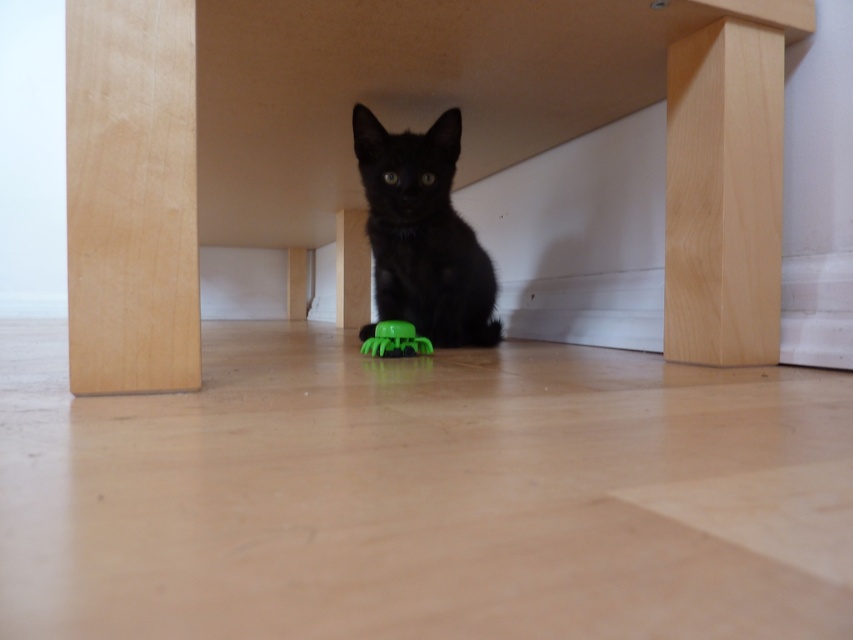
You are a cat owner who wants to ensure the safety of your kitten. The beech wood table at center and the green rubber toy at center are in the same room. Given that the table is 21.99 inches away from the toy, is there enough space for the kitten to move freely between them?

The beech wood table at center is 21.99 inches from the green rubber toy at center, which provides sufficient space for the kitten to move freely between them since 21.99 inches is a comfortable distance for a small kitten to navigate safely.

Where is the beech wood table at center located in the image?

The beech wood table at center is located at point (x=401, y=124) in the image.

Based on the photo, you are a photographer trying to capture the black kitten interacting with the green rubber toy at center. You want to ensure the beech wood table at center is visible in the background. Based on their positions, can you confirm if the table is positioned to the left of the toy?

Yes, the beech wood table at center is to the left of the green rubber toy at center, so it will be visible in the background to the left side of the toy.